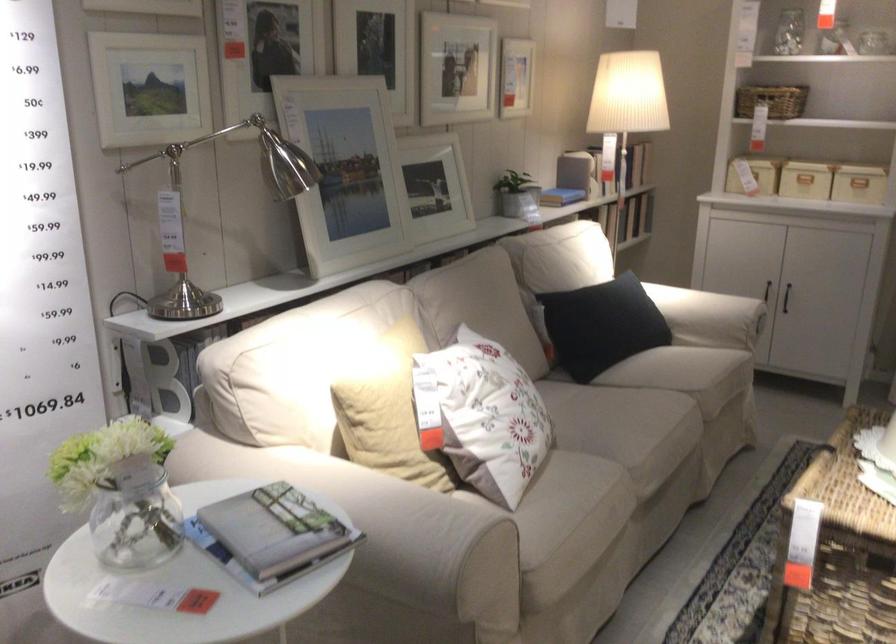
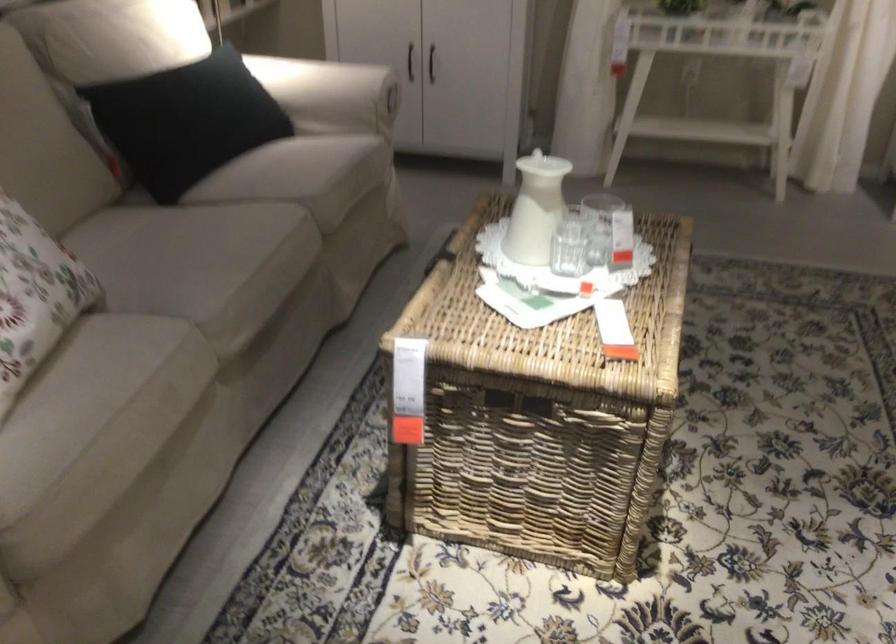
The images are taken continuously from a first-person perspective. In which direction are you moving?

The movement direction of the cameraman is right, forward.